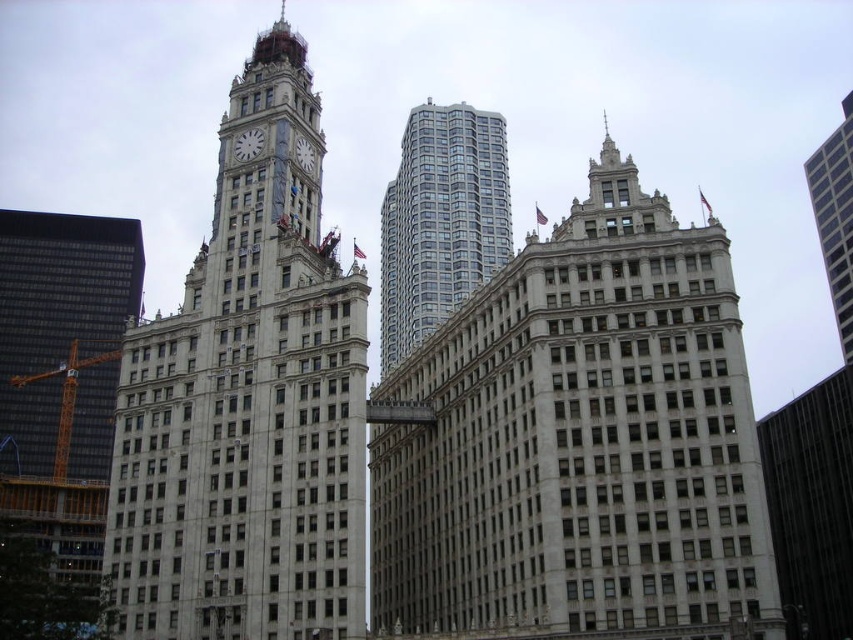
Can you confirm if white stone building at center is positioned to the left of dark glass skyscraper at left?

Incorrect, white stone building at center is not on the left side of dark glass skyscraper at left.

Based on the photo, can you confirm if white stone building at center is thinner than dark glass skyscraper at left?

Yes, white stone building at center is thinner than dark glass skyscraper at left.

This screenshot has height=640, width=853. What do you see at coordinates (578, 440) in the screenshot?
I see `white stone building at center` at bounding box center [578, 440].

Identify the location of white stone building at center. The height and width of the screenshot is (640, 853). 578,440.

Who is higher up, white stone clock tower at center or white marble clock at center?

Positioned higher is white marble clock at center.

Does point (224, 451) lie behind point (242, 132)?

No, (224, 451) is closer to viewer.

The image size is (853, 640). I want to click on white stone clock tower at center, so click(248, 403).

Does white stone building at center appear on the right side of glassy silver skyscraper at center?

Indeed, white stone building at center is positioned on the right side of glassy silver skyscraper at center.

Which is behind, point (596, 518) or point (428, 260)?

Positioned behind is point (428, 260).

Between point (689, 493) and point (430, 116), which one is positioned behind?

Point (430, 116)

You are a GUI agent. You are given a task and a screenshot of the screen. Output one action in this format:
    pyautogui.click(x=<x>, y=<y>)
    Task: Click on the white stone building at center
    Image resolution: width=853 pixels, height=640 pixels.
    Given the screenshot: What is the action you would take?
    pyautogui.click(x=578, y=440)